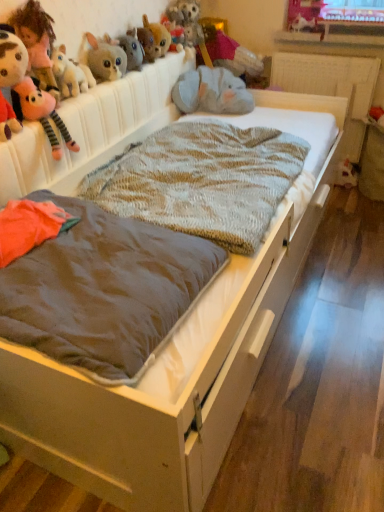
In order to face fluffy gray plush at upper left, arranged as the 7th toy when viewed from the right, should I rotate leftwards or rightwards?

You should look left and rotate roughly 10.961 degrees.

The height and width of the screenshot is (512, 384). In order to click on fluffy gray plush at upper left, marked as the 4th toy in a left-to-right arrangement in this screenshot , I will do `click(105, 58)`.

Image resolution: width=384 pixels, height=512 pixels. What do you see at coordinates (70, 74) in the screenshot?
I see `fluffy plush rabbit at upper left, which is counted as the 3th toy, starting from the left` at bounding box center [70, 74].

Image resolution: width=384 pixels, height=512 pixels. Describe the element at coordinates (174, 27) in the screenshot. I see `fuzzy plush toy at upper center, which is the 6th toy in left-to-right order` at that location.

In order to click on fuzzy plush toy at upper center, which is the fifth toy in right-to-left order in this screenshot , I will do `click(174, 27)`.

What do you see at coordinates (212, 92) in the screenshot?
I see `fuzzy gray elephant at upper center, acting as the 8th toy starting from the left` at bounding box center [212, 92].

The width and height of the screenshot is (384, 512). I want to click on knitted woolen blanket at center, so click(202, 180).

You are a GUI agent. You are given a task and a screenshot of the screen. Output one action in this format:
    pyautogui.click(x=<x>, y=<y>)
    Task: Click on the 4th toy positioned below the fluffy pink plush at upper left, acting as the 2th toy starting from the left (from a real-world perspective)
    The height and width of the screenshot is (512, 384).
    Given the screenshot: What is the action you would take?
    pyautogui.click(x=105, y=58)

Between fluffy gray plush at upper left, arranged as the 7th toy when viewed from the right, and fluffy pink plush at upper left, arranged as the 9th toy when viewed from the right, which one has smaller width?

fluffy pink plush at upper left, arranged as the 9th toy when viewed from the right.

Considering the positions of objects fuzzy brown plush at upper center, marked as the sixth toy in a right-to-left arrangement, and fluffy gray stuffed animal at upper center, which is the 7th toy in left-to-right order, in the image provided, who is more to the left, fuzzy brown plush at upper center, marked as the sixth toy in a right-to-left arrangement, or fluffy gray stuffed animal at upper center, which is the 7th toy in left-to-right order,?

fuzzy brown plush at upper center, marked as the sixth toy in a right-to-left arrangement, is more to the left.

Does fuzzy brown plush at upper center, acting as the 5th toy starting from the left, contain fluffy gray stuffed animal at upper center, which is the 7th toy in left-to-right order?

No, fluffy gray stuffed animal at upper center, which is the 7th toy in left-to-right order, is not surrounded by fuzzy brown plush at upper center, acting as the 5th toy starting from the left.

Who is smaller, fuzzy brown plush at upper center, acting as the 5th toy starting from the left, or fluffy gray stuffed animal at upper center, the fourth toy when ordered from right to left?

fuzzy brown plush at upper center, acting as the 5th toy starting from the left.

From a real-world perspective, is fluffy gray stuffed animal at upper center, which is the 7th toy in left-to-right order, over white plush toy at lower right, arranged as the tenth toy when viewed from the left?

Correct, in the physical world, fluffy gray stuffed animal at upper center, which is the 7th toy in left-to-right order, is higher than white plush toy at lower right, arranged as the tenth toy when viewed from the left.

Considering the positions of point (201, 32) and point (352, 177), is point (201, 32) closer or farther from the camera than point (352, 177)?

Point (201, 32) is positioned closer to the camera compared to point (352, 177).

Is fluffy gray stuffed animal at upper center, which is the 7th toy in left-to-right order, at the left side of white plush toy at lower right, arranged as the tenth toy when viewed from the left?

Indeed, fluffy gray stuffed animal at upper center, which is the 7th toy in left-to-right order, is positioned on the left side of white plush toy at lower right, arranged as the tenth toy when viewed from the left.

In the scene shown: Between fluffy pink plush at upper left, which is counted as the tenth toy, starting from the right, and velvet pink teddy bear at upper center, the ninth toy when ordered from left to right, which one appears on the right side from the viewer's perspective?

From the viewer's perspective, velvet pink teddy bear at upper center, the ninth toy when ordered from left to right, appears more on the right side.

From a real-world perspective, between fluffy pink plush at upper left, the first toy viewed from the left, and velvet pink teddy bear at upper center, placed as the second toy when sorted from right to left, who is vertically higher?

fluffy pink plush at upper left, the first toy viewed from the left.

Is fluffy pink plush at upper left, which is counted as the tenth toy, starting from the right, looking in the opposite direction of velvet pink teddy bear at upper center, the ninth toy when ordered from left to right?

No, fluffy pink plush at upper left, which is counted as the tenth toy, starting from the right, is not facing the opposite direction of velvet pink teddy bear at upper center, the ninth toy when ordered from left to right.

Which object is further away from the camera taking this photo, fluffy gray stuffed animal at upper center, which is the 7th toy in left-to-right order, or fluffy pink plush at upper left, which is counted as the tenth toy, starting from the right?

fluffy gray stuffed animal at upper center, which is the 7th toy in left-to-right order, is further from the camera.

From a real-world perspective, starting from the fluffy pink plush at upper left, which is counted as the tenth toy, starting from the right, which toy is the 5th one below it? Please provide its 2D coordinates.

[(189, 25)]

Considering the sizes of fluffy gray stuffed animal at upper center, the fourth toy when ordered from right to left, and fluffy pink plush at upper left, the first toy viewed from the left, in the image, is fluffy gray stuffed animal at upper center, the fourth toy when ordered from right to left, bigger or smaller than fluffy pink plush at upper left, the first toy viewed from the left,?

In the image, fluffy gray stuffed animal at upper center, the fourth toy when ordered from right to left, appears to be larger than fluffy pink plush at upper left, the first toy viewed from the left.

Does fluffy gray stuffed animal at upper center, which is the 7th toy in left-to-right order, have a greater height compared to fluffy pink plush at upper left, which is counted as the tenth toy, starting from the right?

No, fluffy gray stuffed animal at upper center, which is the 7th toy in left-to-right order, is not taller than fluffy pink plush at upper left, which is counted as the tenth toy, starting from the right.

Could you tell me if fluffy gray stuffed animal at upper center, the fourth toy when ordered from right to left, is turned towards brown fabric mattress at center?

No, fluffy gray stuffed animal at upper center, the fourth toy when ordered from right to left, is not turned towards brown fabric mattress at center.

How many degrees apart are the facing directions of fluffy gray stuffed animal at upper center, which is the 7th toy in left-to-right order, and brown fabric mattress at center?

There is a 4.92e-05-degree angle between the facing directions of fluffy gray stuffed animal at upper center, which is the 7th toy in left-to-right order, and brown fabric mattress at center.

Which is in front, point (176, 19) or point (106, 344)?

The point (106, 344) is in front.

Which of these two, fluffy gray stuffed animal at upper center, the fourth toy when ordered from right to left, or brown fabric mattress at center, is smaller?

fluffy gray stuffed animal at upper center, the fourth toy when ordered from right to left, is smaller.

From a real-world perspective, between fluffy gray plush at upper left, marked as the 4th toy in a left-to-right arrangement, and white plush toy at lower right, arranged as the tenth toy when viewed from the left, who is vertically higher?

In real-world perspective, fluffy gray plush at upper left, marked as the 4th toy in a left-to-right arrangement, is above.

Consider the image. In the image, is fluffy gray plush at upper left, arranged as the 7th toy when viewed from the right, positioned in front of or behind white plush toy at lower right, which appears as the 1th toy when viewed from the right?

Clearly, fluffy gray plush at upper left, arranged as the 7th toy when viewed from the right, is in front of white plush toy at lower right, which appears as the 1th toy when viewed from the right.

Identify the location of the 6th toy in front of the white plush toy at lower right, arranged as the tenth toy when viewed from the left, counting from the anchor's position. The height and width of the screenshot is (512, 384). (105, 58).

Visually, is fluffy gray plush at upper left, arranged as the 7th toy when viewed from the right, positioned to the left or to the right of white plush toy at lower right, which appears as the 1th toy when viewed from the right?

fluffy gray plush at upper left, arranged as the 7th toy when viewed from the right, is positioned on white plush toy at lower right, which appears as the 1th toy when viewed from the right,'s left side.

I want to click on the 2nd toy to the left when counting from the fluffy gray plush at upper left, arranged as the 7th toy when viewed from the right, so click(37, 42).

You are a GUI agent. You are given a task and a screenshot of the screen. Output one action in this format:
    pyautogui.click(x=<x>, y=<y>)
    Task: Click on the 4th toy located beneath the fuzzy brown plush at upper center, marked as the sixth toy in a right-to-left arrangement (from a real-world perspective)
    This screenshot has height=512, width=384.
    Given the screenshot: What is the action you would take?
    pyautogui.click(x=189, y=25)

Considering their positions, is brown fabric mattress at center positioned closer to fluffy plush rabbit at upper left, which is counted as the 3th toy, starting from the left, than fluffy pink plush at upper left, acting as the 2th toy starting from the left?

fluffy pink plush at upper left, acting as the 2th toy starting from the left, is closer to fluffy plush rabbit at upper left, which is counted as the 3th toy, starting from the left.

Which object lies further to the anchor point brown fabric mattress at center, fluffy plush rabbit at upper left, which is counted as the 3th toy, starting from the left, or fluffy gray plush at upper left, marked as the 4th toy in a left-to-right arrangement?

fluffy gray plush at upper left, marked as the 4th toy in a left-to-right arrangement, is further to brown fabric mattress at center.

When comparing their distances from fuzzy plush toy at upper center, which is the 6th toy in left-to-right order, does fuzzy gray elephant at upper center, arranged as the 3th toy when viewed from the right, or white plush toy at lower right, arranged as the tenth toy when viewed from the left, seem further?

Based on the image, white plush toy at lower right, arranged as the tenth toy when viewed from the left, appears to be further to fuzzy plush toy at upper center, which is the 6th toy in left-to-right order.

From the picture: When comparing their distances from fluffy pink plush at upper left, arranged as the 9th toy when viewed from the right, does fuzzy gray elephant at upper center, acting as the 8th toy starting from the left, or brown fabric mattress at center seem closer?

brown fabric mattress at center is closer to fluffy pink plush at upper left, arranged as the 9th toy when viewed from the right.

From the image, which object appears to be nearer to fuzzy brown plush at upper center, acting as the 5th toy starting from the left, brown fabric mattress at center or fuzzy plush toy at upper center, which is the 6th toy in left-to-right order?

fuzzy plush toy at upper center, which is the 6th toy in left-to-right order, is closer to fuzzy brown plush at upper center, acting as the 5th toy starting from the left.

Estimate the real-world distances between objects in this image. Which object is further from brown fabric mattress at center, fluffy gray stuffed animal at upper center, the fourth toy when ordered from right to left, or fluffy pink plush at upper left, which is counted as the tenth toy, starting from the right?

fluffy gray stuffed animal at upper center, the fourth toy when ordered from right to left, is positioned further to the anchor brown fabric mattress at center.

When comparing their distances from fluffy pink plush at upper left, the first toy viewed from the left, does fluffy gray stuffed animal at upper center, the fourth toy when ordered from right to left, or brown fabric mattress at center seem further?

The object further to fluffy pink plush at upper left, the first toy viewed from the left, is fluffy gray stuffed animal at upper center, the fourth toy when ordered from right to left.

Considering their positions, is fluffy pink plush at upper left, the first toy viewed from the left, positioned further to fluffy gray stuffed animal at upper center, the fourth toy when ordered from right to left, than white plush toy at lower right, which appears as the 1th toy when viewed from the right?

fluffy pink plush at upper left, the first toy viewed from the left, is further to fluffy gray stuffed animal at upper center, the fourth toy when ordered from right to left.

You are a GUI agent. You are given a task and a screenshot of the screen. Output one action in this format:
    pyautogui.click(x=<x>, y=<y>)
    Task: Click on the toy situated between fluffy gray stuffed animal at upper center, the fourth toy when ordered from right to left, and velvet pink teddy bear at upper center, placed as the second toy when sorted from right to left, from left to right
    Image resolution: width=384 pixels, height=512 pixels.
    Given the screenshot: What is the action you would take?
    pyautogui.click(x=212, y=92)

Find the location of `blanket between brown fabric mattress at center and fluffy gray stuffed animal at upper center, the fourth toy when ordered from right to left, along the z-axis`. blanket between brown fabric mattress at center and fluffy gray stuffed animal at upper center, the fourth toy when ordered from right to left, along the z-axis is located at coordinates tap(202, 180).

At what (x,y) coordinates should I click in order to perform the action: click on blanket positioned between fluffy pink plush at upper left, which is counted as the tenth toy, starting from the right, and velvet pink teddy bear at upper center, the ninth toy when ordered from left to right, from near to far. Please return your answer as a coordinate pair (x, y). Looking at the image, I should click on (202, 180).

Image resolution: width=384 pixels, height=512 pixels. Identify the location of blanket located between brown fabric mattress at center and fuzzy brown plush at upper center, acting as the 5th toy starting from the left, in the depth direction. (202, 180).